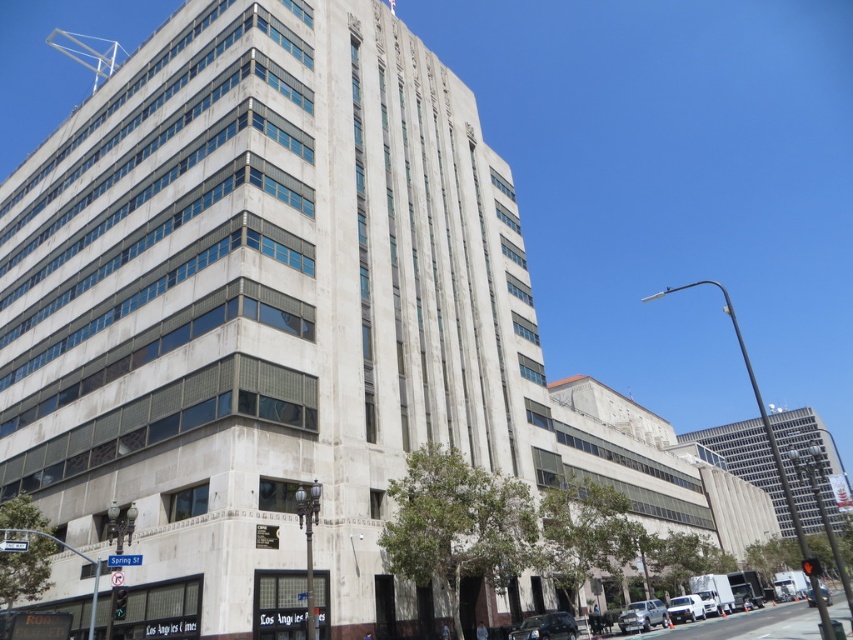
Can you confirm if shiny black sedan at lower right is positioned to the right of silver metallic sedan at lower right?

No, shiny black sedan at lower right is not to the right of silver metallic sedan at lower right.

Does shiny black sedan at lower right have a larger size compared to silver metallic sedan at lower right?

Yes, shiny black sedan at lower right is bigger than silver metallic sedan at lower right.

Between point (523, 625) and point (643, 605), which one is positioned behind?

The point (643, 605) is behind.

Find the location of a particular element. The height and width of the screenshot is (640, 853). shiny black sedan at lower right is located at coordinates (546, 627).

At what (x,y) coordinates should I click in order to perform the action: click on white matte car at lower right. Please return your answer as a coordinate pair (x, y). Image resolution: width=853 pixels, height=640 pixels. Looking at the image, I should click on (685, 609).

Who is more distant from viewer, (691, 618) or (811, 595)?

The point (811, 595) is more distant.

Is point (689, 602) positioned behind point (810, 589)?

No, it is not.

You are a GUI agent. You are given a task and a screenshot of the screen. Output one action in this format:
    pyautogui.click(x=<x>, y=<y>)
    Task: Click on the white matte car at lower right
    
    Given the screenshot: What is the action you would take?
    pyautogui.click(x=685, y=609)

Can you confirm if silver metallic sedan at lower right is positioned below white matte car at lower right?

No, silver metallic sedan at lower right is not below white matte car at lower right.

Who is lower down, silver metallic sedan at lower right or white matte car at lower right?

white matte car at lower right

Does point (664, 614) come behind point (683, 618)?

No, it is in front of (683, 618).

Where is `silver metallic sedan at lower right`? silver metallic sedan at lower right is located at coordinates (642, 616).